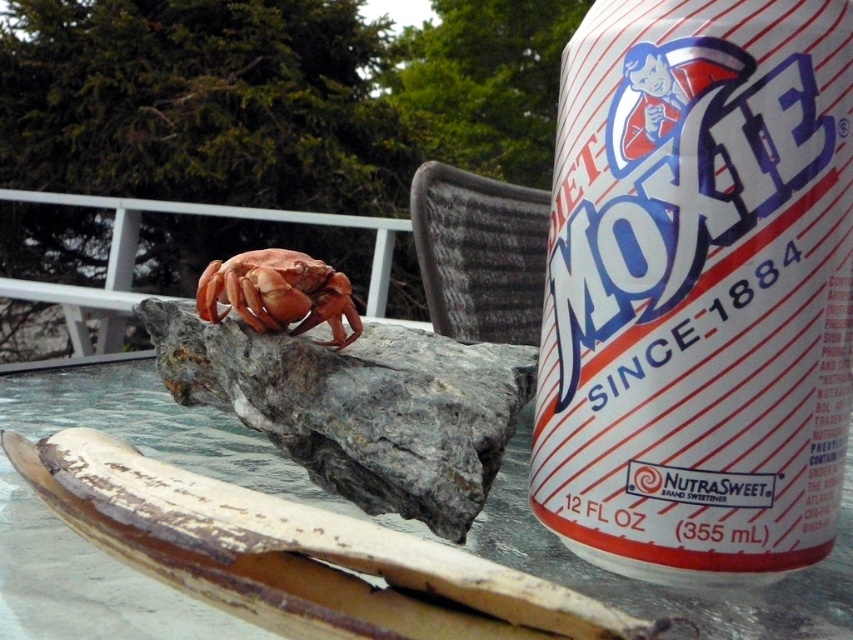
You are trying to reach for the white paper can at upper right but there is a smooth orange crab at center in the way. Which direction should you move the crab to clear the path?

The white paper can at upper right is to the right of the smooth orange crab at center, so you should move the smooth orange crab at center to the left to clear the path.

You are looking at a closeup of a can of Diet Moxie on a table. There is a small crab on a rock to the left. A point marked at coordinates (698, 289) is on the white paper can at upper right. If you were to draw a line from the crab to this point, would it pass over the can?

The point marked at (698, 289) is on the white paper can at upper right. Since the crab is on the left side of the can, drawing a line from the crab to the point on the can would pass over the can itself.